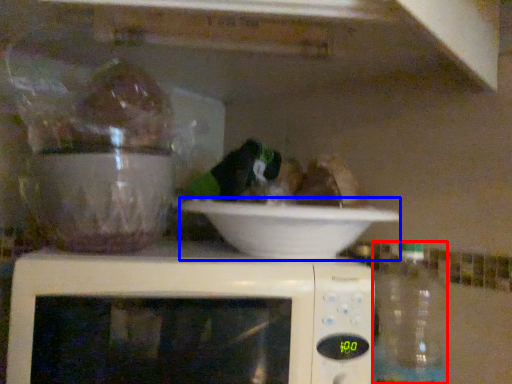
Question: Which point is closer to the camera, bottle (highlighted by a red box) or bowl (highlighted by a blue box)?

Choices:
 (A) bottle
 (B) bowl

Answer: (B)